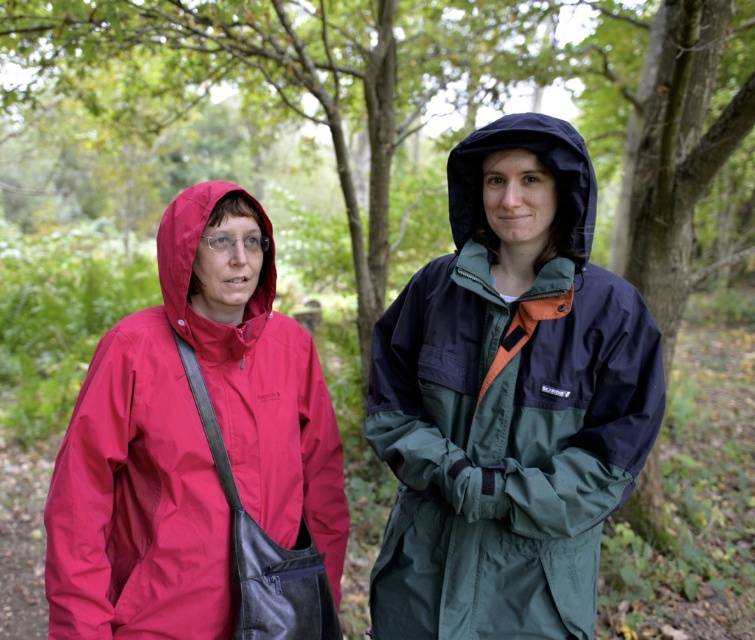
Question: Among these objects, which one is farthest from the camera?

Choices:
 (A) matte red jacket at left
 (B) matte red hood at left
 (C) green matte jacket at center

Answer: (B)

Question: Does green matte jacket at center have a greater width compared to black matte hood at upper center?

Choices:
 (A) yes
 (B) no

Answer: (A)

Question: Which point is closer to the camera?

Choices:
 (A) (492, 596)
 (B) (529, 120)
 (C) (193, 193)
 (D) (196, 484)

Answer: (B)

Question: Observing the image, what is the correct spatial positioning of matte red raincoat at left in reference to matte red hood at left?

Choices:
 (A) right
 (B) left

Answer: (A)

Question: Which of the following is the closest to the observer?

Choices:
 (A) black matte hood at upper center
 (B) matte red hood at left

Answer: (A)

Question: Can you confirm if matte red jacket at left is positioned below green matte jacket at center?

Choices:
 (A) no
 (B) yes

Answer: (B)